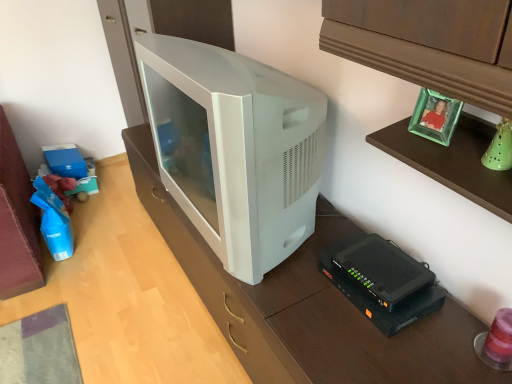
The height and width of the screenshot is (384, 512). What do you see at coordinates (234, 148) in the screenshot?
I see `white plastic television at center` at bounding box center [234, 148].

At what (x,y) coordinates should I click in order to perform the action: click on white plastic television at center. Please return your answer as a coordinate pair (x, y). This screenshot has width=512, height=384. Looking at the image, I should click on (234, 148).

This screenshot has width=512, height=384. I want to click on black plastic router at lower right, so click(383, 271).

Describe the element at coordinates (383, 271) in the screenshot. This screenshot has width=512, height=384. I see `black plastic router at lower right` at that location.

Image resolution: width=512 pixels, height=384 pixels. Find the location of `white plastic television at center`. white plastic television at center is located at coordinates (234, 148).

Which object is positioned more to the left, white plastic television at center or black plastic router at lower right?

From the viewer's perspective, white plastic television at center appears more on the left side.

Is white plastic television at center positioned before black plastic router at lower right?

Yes, white plastic television at center is closer to the camera.

Does point (190, 143) lie behind point (364, 287)?

Yes, point (190, 143) is farther from viewer.

From the image's perspective, which object appears higher, white plastic television at center or black plastic router at lower right?

white plastic television at center is shown above in the image.

From a real-world perspective, is white plastic television at center positioned above or below black plastic router at lower right?

In terms of real-world spatial position, white plastic television at center is above black plastic router at lower right.

Can you confirm if white plastic television at center is thinner than black plastic router at lower right?

Incorrect, the width of white plastic television at center is not less than that of black plastic router at lower right.

Is white plastic television at center taller or shorter than black plastic router at lower right?

white plastic television at center is taller than black plastic router at lower right.

Is white plastic television at center bigger than black plastic router at lower right?

Yes.

Do you think white plastic television at center is within black plastic router at lower right, or outside of it?

white plastic television at center is not enclosed by black plastic router at lower right.

Is white plastic television at center touching black plastic router at lower right?

No, white plastic television at center is not beside black plastic router at lower right.

Is white plastic television at center positioned with its back to black plastic router at lower right?

No.

Can you tell me how much white plastic television at center and black plastic router at lower right differ in facing direction?

The angular difference between white plastic television at center and black plastic router at lower right is 2.04 degrees.

Identify the location of appliance on the right of white plastic television at center. (383, 271).

Based on their positions, is black plastic router at lower right located to the left or right of white plastic television at center?

In the image, black plastic router at lower right appears on the right side of white plastic television at center.

Which is behind, black plastic router at lower right or white plastic television at center?

Positioned behind is black plastic router at lower right.

Does point (349, 252) come farther from viewer compared to point (138, 59)?

That is False.

From the image's perspective, does black plastic router at lower right appear lower than white plastic television at center?

Indeed, from the image's perspective, black plastic router at lower right is shown beneath white plastic television at center.

Based on the photo, from a real-world perspective, which is physically above, black plastic router at lower right or white plastic television at center?

white plastic television at center, from a real-world perspective.

Is black plastic router at lower right thinner than white plastic television at center?

Indeed, black plastic router at lower right has a lesser width compared to white plastic television at center.

Is black plastic router at lower right shorter than white plastic television at center?

Indeed, black plastic router at lower right has a lesser height compared to white plastic television at center.

Can you confirm if black plastic router at lower right is smaller than white plastic television at center?

Yes.

Is black plastic router at lower right completely or partially outside of white plastic television at center?

Absolutely, black plastic router at lower right is external to white plastic television at center.

Are black plastic router at lower right and white plastic television at center located far from each other?

No, there isn't a large distance between black plastic router at lower right and white plastic television at center.

Is black plastic router at lower right oriented away from white plastic television at center?

black plastic router at lower right is not turned away from white plastic television at center.

Where is `television on the left of black plastic router at lower right`? The height and width of the screenshot is (384, 512). television on the left of black plastic router at lower right is located at coordinates (234, 148).

At what (x,y) coordinates should I click in order to perform the action: click on appliance located underneath the white plastic television at center (from a real-world perspective). Please return your answer as a coordinate pair (x, y). The image size is (512, 384). Looking at the image, I should click on (383, 271).

I want to click on appliance located below the white plastic television at center (from the image's perspective), so click(x=383, y=271).